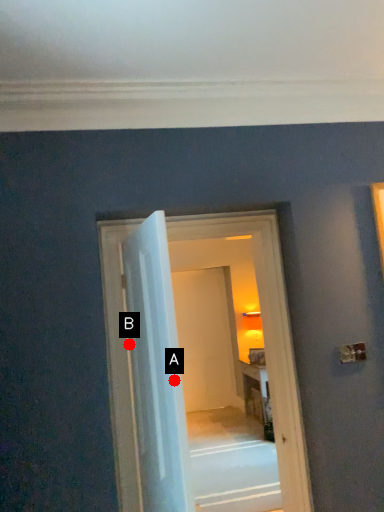
Question: Two points are circled on the image, labeled by A and B beside each circle. Which point is farther to the camera?

Choices:
 (A) A is further
 (B) B is further

Answer: (B)